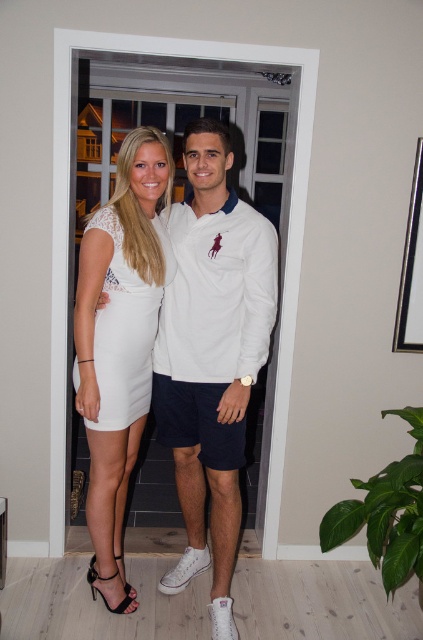
Question: Which of these objects is positioned farthest from the white lace dress at center?

Choices:
 (A) white satin dress at center
 (B) white matte dress at center

Answer: (B)

Question: Observing the image, what is the correct spatial positioning of white lace dress at center in reference to white satin dress at center?

Choices:
 (A) left
 (B) right

Answer: (A)

Question: Is white lace dress at center thinner than white satin dress at center?

Choices:
 (A) yes
 (B) no

Answer: (A)

Question: Which object appears farthest from the camera in this image?

Choices:
 (A) white matte dress at center
 (B) white satin dress at center
 (C) white lace dress at center

Answer: (C)

Question: Estimate the real-world distances between objects in this image. Which object is farther from the white matte dress at center?

Choices:
 (A) white lace dress at center
 (B) white satin dress at center

Answer: (B)

Question: Considering the relative positions of white matte dress at center and white satin dress at center in the image provided, where is white matte dress at center located with respect to white satin dress at center?

Choices:
 (A) left
 (B) right

Answer: (B)